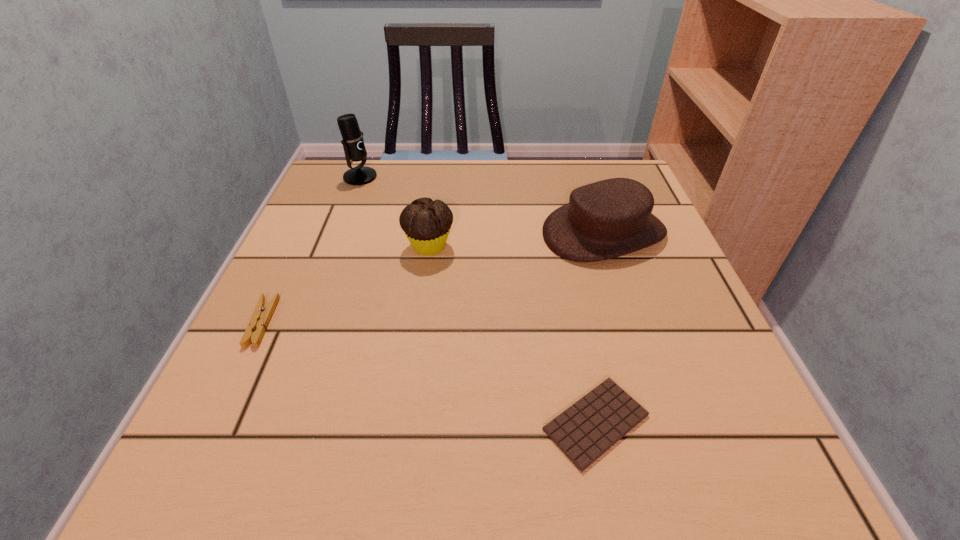
Locate an element on the screen. the tallest object is located at coordinates (353, 143).

This screenshot has height=540, width=960. I want to click on the farthest object, so tap(353, 143).

Image resolution: width=960 pixels, height=540 pixels. Find the location of `muffin`. muffin is located at coordinates [x=426, y=223].

This screenshot has width=960, height=540. In order to click on hat in this screenshot , I will do `click(610, 218)`.

Locate an element on the screen. The width and height of the screenshot is (960, 540). the leftmost object is located at coordinates (261, 316).

The height and width of the screenshot is (540, 960). Find the location of `clothespin`. clothespin is located at coordinates (261, 316).

Locate an element on the screen. The image size is (960, 540). the shortest object is located at coordinates (586, 430).

Locate an element on the screen. Image resolution: width=960 pixels, height=540 pixels. chocolate bar is located at coordinates (586, 430).

The image size is (960, 540). Identify the location of free space located 0.080m on the front of the tallest object. (349, 204).

Find the location of a particular element. vacant space located 0.230m on the front of the third object from left to right is located at coordinates (414, 361).